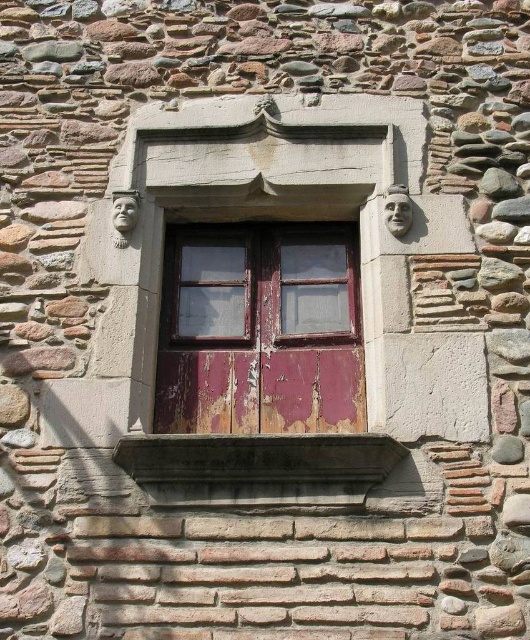
Can you confirm if wooden window at center is positioned to the left of smooth stone window sill at center?

Yes, wooden window at center is to the left of smooth stone window sill at center.

This screenshot has height=640, width=530. In order to click on wooden window at center in this screenshot , I will do `click(260, 285)`.

Does point (246, 316) lie in front of point (172, 445)?

That is False.

Where is `wooden window at center`? Image resolution: width=530 pixels, height=640 pixels. wooden window at center is located at coordinates [x=260, y=285].

Between point (195, 282) and point (313, 477), which one is positioned in front?

Point (313, 477)

The height and width of the screenshot is (640, 530). What do you see at coordinates (260, 330) in the screenshot? I see `peeling paint wooden window at center` at bounding box center [260, 330].

I want to click on peeling paint wooden window at center, so click(260, 330).

Can you confirm if peeling paint wooden window at center is thinner than wooden window at center?

No.

Who is positioned more to the right, peeling paint wooden window at center or wooden window at center?

Positioned to the right is peeling paint wooden window at center.

Does point (179, 266) lie in front of point (313, 305)?

No, (179, 266) is behind (313, 305).

The width and height of the screenshot is (530, 640). I want to click on peeling paint wooden window at center, so click(260, 330).